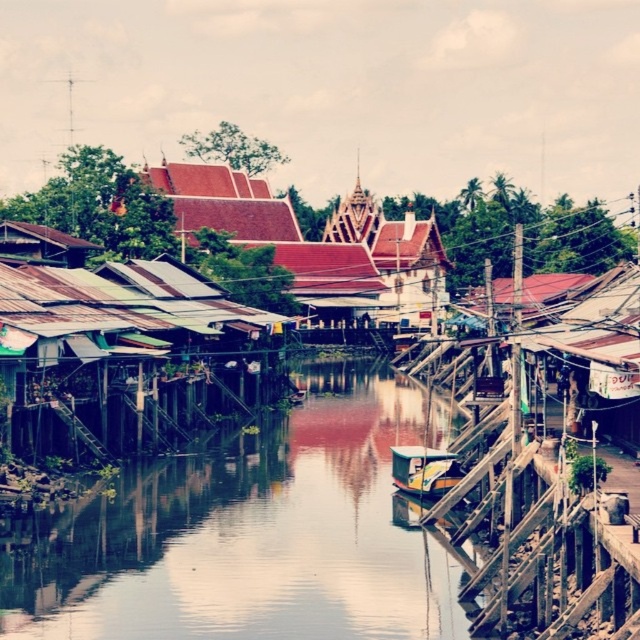
Can you confirm if smooth concrete river at center is positioned below green plastic boat at center?

Indeed, smooth concrete river at center is positioned under green plastic boat at center.

Consider the image. Is smooth concrete river at center taller than green plastic boat at center?

Yes.

Find the location of a particular element. The image size is (640, 640). smooth concrete river at center is located at coordinates [252, 536].